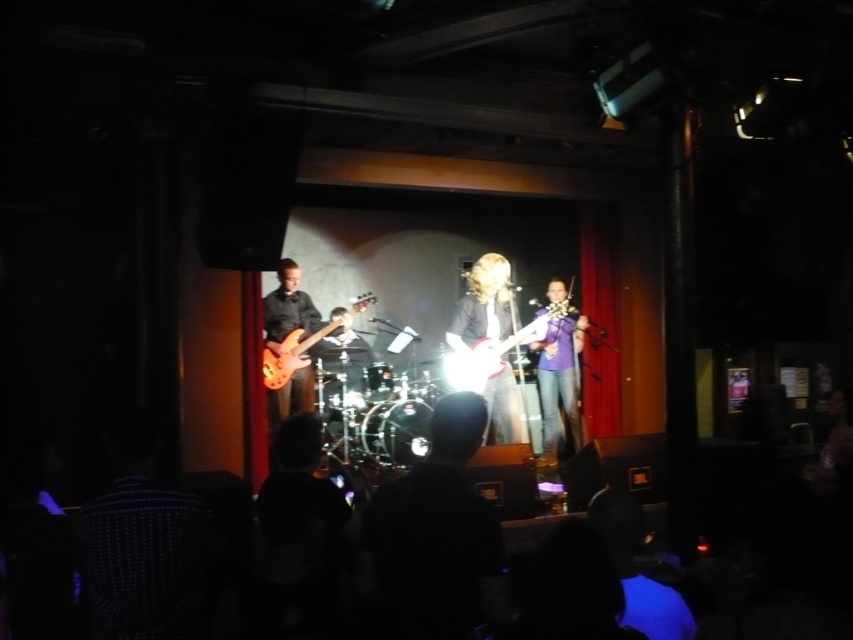
You are a photographer standing at the back of the venue. You want to capture a closeup shot of the purple fabric violin at center. Given that your camera has a maximum zoom range of 5 meters, will you be able to get a clear closeup without moving closer?

The purple fabric violin at center is 5.86 meters away from the camera. Since the camera can only zoom up to 5 meters, you won not be able to get a clear closeup without moving closer.

You are a stagehand who needs to place a protective cover over the purple fabric violin at center and the shiny red electric guitar at center. Which instrument requires a smaller cover in terms of width?

The purple fabric violin at center requires a smaller cover because its width is less than that of the shiny red electric guitar at center.